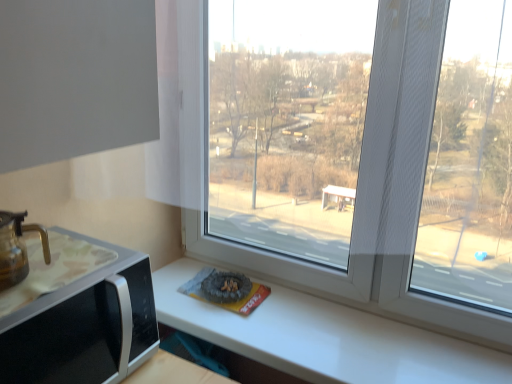
The image size is (512, 384). I want to click on vacant space to the right of translucent glass coffeepot at lower left, so [71, 291].